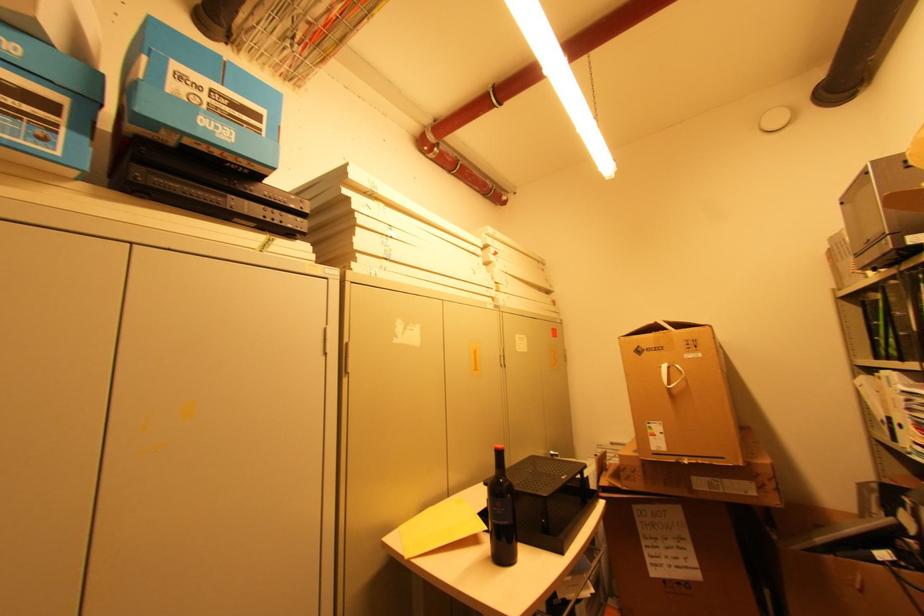
What do you see at coordinates (198, 100) in the screenshot? I see `the blue cardboard box` at bounding box center [198, 100].